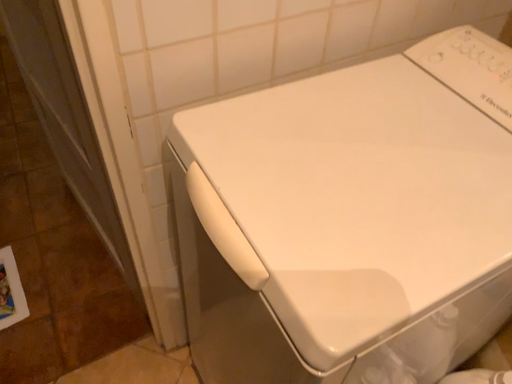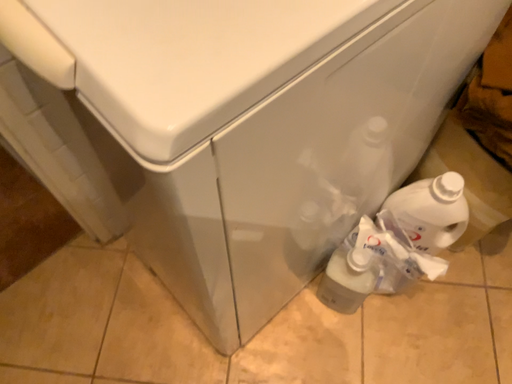
Question: Which way did the camera rotate in the video?

Choices:
 (A) rotated upward
 (B) rotated downward

Answer: (B)